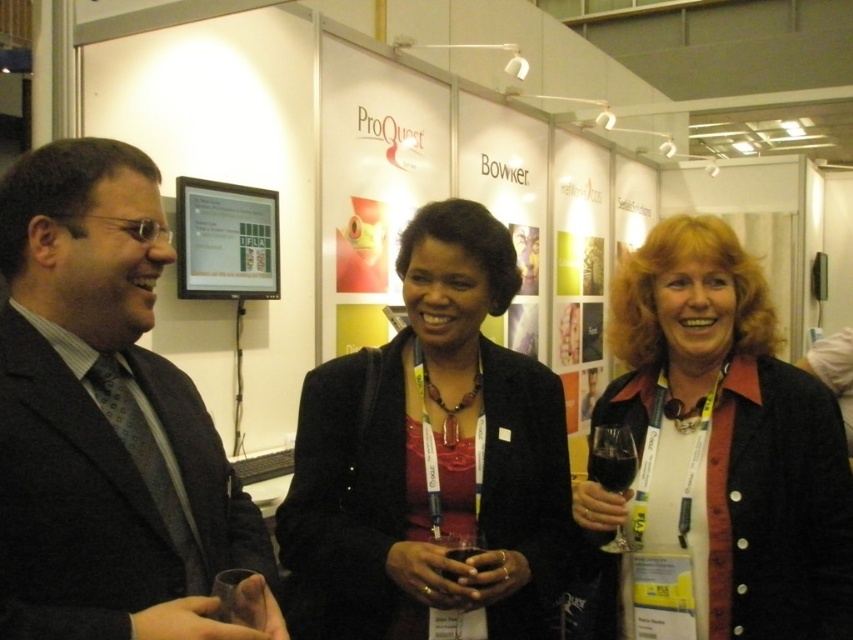
Is point (534, 460) more distant than point (751, 528)?

Yes, point (534, 460) is behind point (751, 528).

Does black matte blazer at center have a larger size compared to matte black jacket at center?

Yes, black matte blazer at center is bigger than matte black jacket at center.

Between point (503, 346) and point (718, 333), which one is positioned behind?

The point (503, 346) is behind.

Where is `black matte blazer at center`? The height and width of the screenshot is (640, 853). black matte blazer at center is located at coordinates (430, 458).

Which of these two, dark gray suit at center or black matte blazer at center, stands taller?

With more height is black matte blazer at center.

Is dark gray suit at center taller than black matte blazer at center?

In fact, dark gray suit at center may be shorter than black matte blazer at center.

Which is behind, point (178, 403) or point (374, 410)?

The point (374, 410) is behind.

You are a GUI agent. You are given a task and a screenshot of the screen. Output one action in this format:
    pyautogui.click(x=<x>, y=<y>)
    Task: Click on the dark gray suit at center
    This screenshot has height=640, width=853.
    Given the screenshot: What is the action you would take?
    point(103,419)

Can you confirm if black matte blazer at center is wider than clear glass at center?

Correct, the width of black matte blazer at center exceeds that of clear glass at center.

Measure the distance between point (440, 227) and camera.

The distance of point (440, 227) from camera is 4.46 feet.

Where is `black matte blazer at center`? black matte blazer at center is located at coordinates (430, 458).